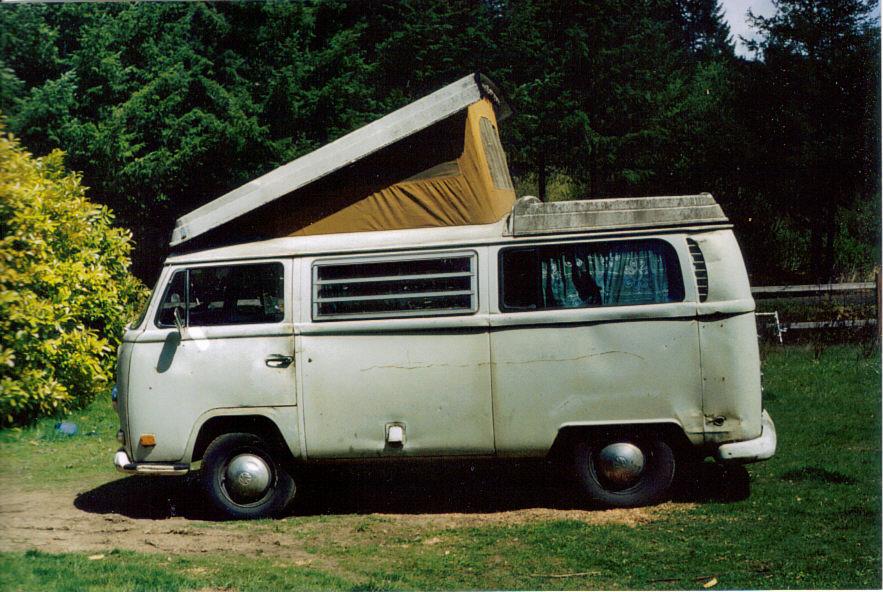
Where is `windows`? This screenshot has width=883, height=592. windows is located at coordinates (385, 287), (584, 294), (213, 289).